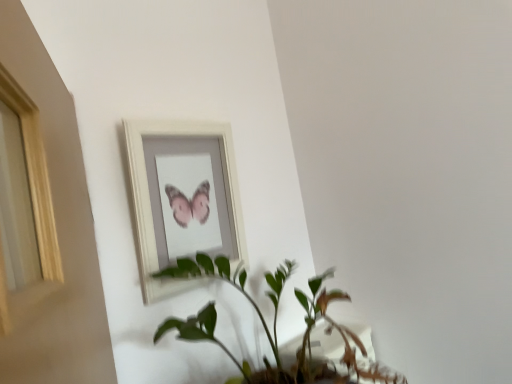
Question: Do you think green leafy plant at center is within white wooden picture frame at upper center, or outside of it?

Choices:
 (A) outside
 (B) inside

Answer: (A)

Question: Is point (292, 372) closer or farther from the camera than point (172, 178)?

Choices:
 (A) closer
 (B) farther

Answer: (A)

Question: Based on their sizes in the image, would you say green leafy plant at center is bigger or smaller than white wooden picture frame at upper center?

Choices:
 (A) big
 (B) small

Answer: (A)

Question: Does point (189, 187) appear closer or farther from the camera than point (327, 304)?

Choices:
 (A) farther
 (B) closer

Answer: (B)

Question: Visually, is white wooden picture frame at upper center positioned to the left or to the right of green leafy plant at center?

Choices:
 (A) right
 (B) left

Answer: (B)

Question: In terms of width, does white wooden picture frame at upper center look wider or thinner when compared to green leafy plant at center?

Choices:
 (A) wide
 (B) thin

Answer: (B)

Question: Is white wooden picture frame at upper center spatially inside green leafy plant at center, or outside of it?

Choices:
 (A) outside
 (B) inside

Answer: (A)